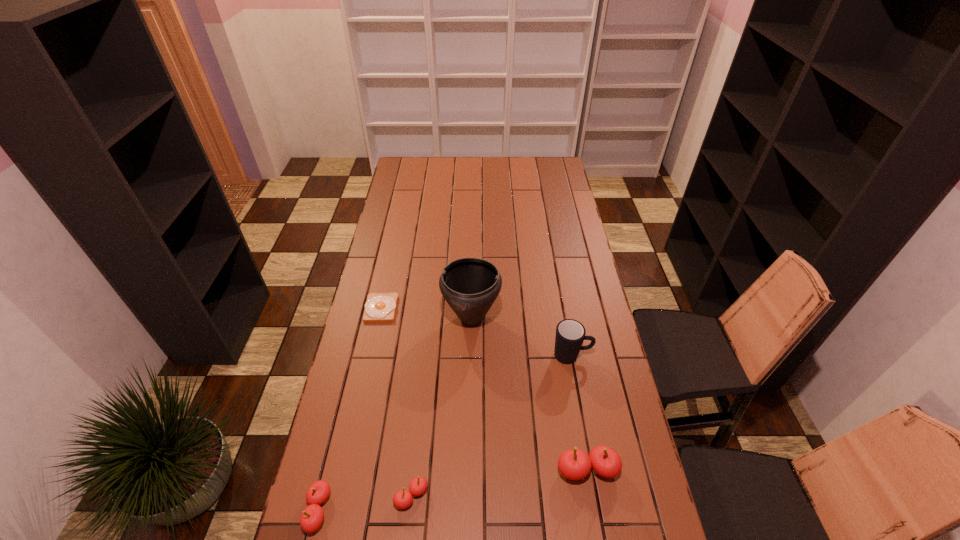
Identify the location of vacant space at the left edge. (324, 444).

Locate an element on the screen. The image size is (960, 540). vacant area at the right edge is located at coordinates (561, 230).

The image size is (960, 540). Identify the location of empty location between the shortest object and the fourth nearest object. (476, 332).

The height and width of the screenshot is (540, 960). I want to click on free point between the toast and the urn, so click(x=426, y=313).

At what (x,y) coordinates should I click in order to perform the action: click on free spot between the second shortest object and the mug. Please return your answer as a coordinate pair (x, y). Image resolution: width=960 pixels, height=540 pixels. Looking at the image, I should click on (492, 426).

Image resolution: width=960 pixels, height=540 pixels. I want to click on empty space between the rightmost cherry and the second shortest cherry, so click(x=452, y=490).

This screenshot has height=540, width=960. I want to click on unoccupied area between the leftmost cherry and the third object from right to left, so click(x=395, y=414).

Image resolution: width=960 pixels, height=540 pixels. I want to click on free spot between the shortest object and the urn, so click(426, 313).

Find the location of `free area in between the toast and the fifth tallest object`. free area in between the toast and the fifth tallest object is located at coordinates (396, 402).

Where is `empty space that is in between the third object from left to right and the third shortest object`? empty space that is in between the third object from left to right and the third shortest object is located at coordinates (365, 503).